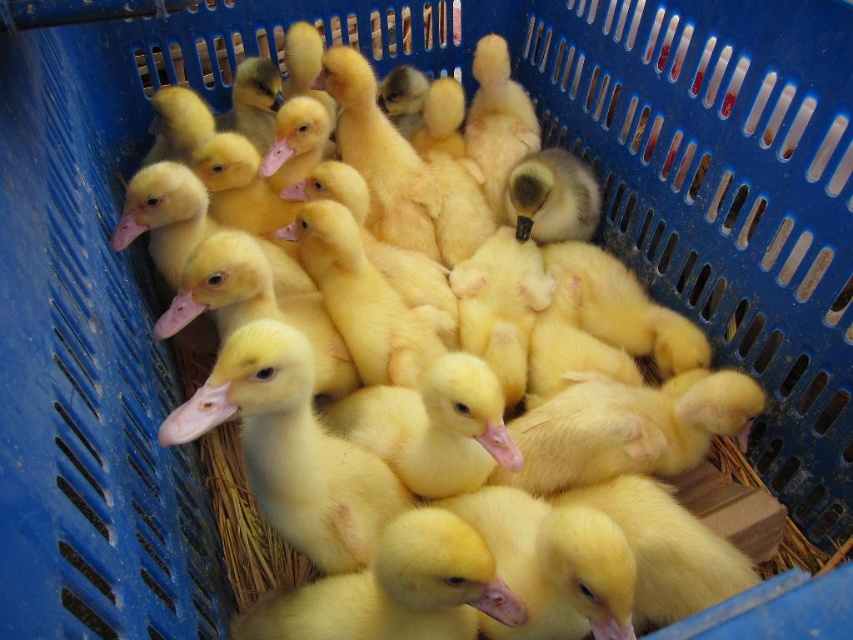
Question: Which point is farther to the camera?

Choices:
 (A) (357, 474)
 (B) (485, 588)

Answer: (A)

Question: Which object is farther from the camera taking this photo?

Choices:
 (A) yellow matte duckling at center
 (B) smooth yellow duckling at center

Answer: (B)

Question: Which point appears farthest from the camera in this image?

Choices:
 (A) (311, 634)
 (B) (219, 378)

Answer: (A)

Question: Is smooth yellow duckling at center positioned before yellow matte duckling at center?

Choices:
 (A) yes
 (B) no

Answer: (B)

Question: In this image, where is smooth yellow duckling at center located relative to yellow matte duckling at center?

Choices:
 (A) above
 (B) below

Answer: (A)

Question: Considering the relative positions of smooth yellow duckling at center and yellow matte duckling at center in the image provided, where is smooth yellow duckling at center located with respect to yellow matte duckling at center?

Choices:
 (A) right
 (B) left

Answer: (B)